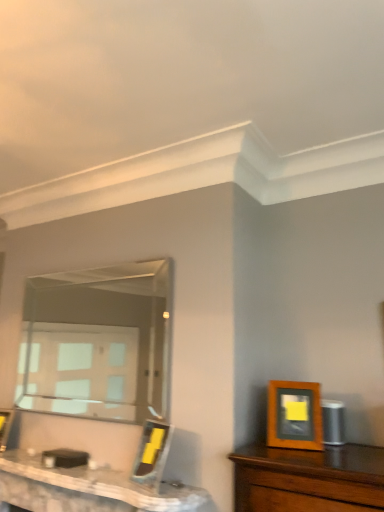
Find the location of `unoccupied area in front of wooden picture frame at center, which is counted as the 2th picture frame, starting from the left`. unoccupied area in front of wooden picture frame at center, which is counted as the 2th picture frame, starting from the left is located at coordinates (162, 497).